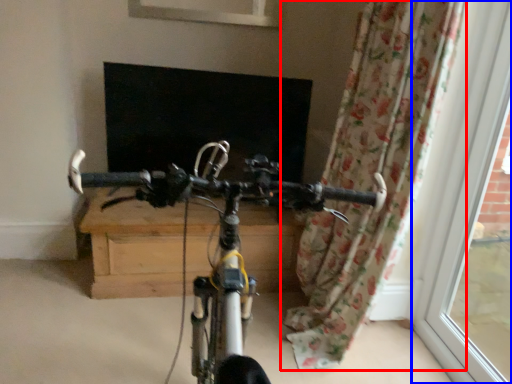
Question: Which object is further to the camera taking this photo, curtain (highlighted by a red box) or window frame (highlighted by a blue box)?

Choices:
 (A) curtain
 (B) window frame

Answer: (A)